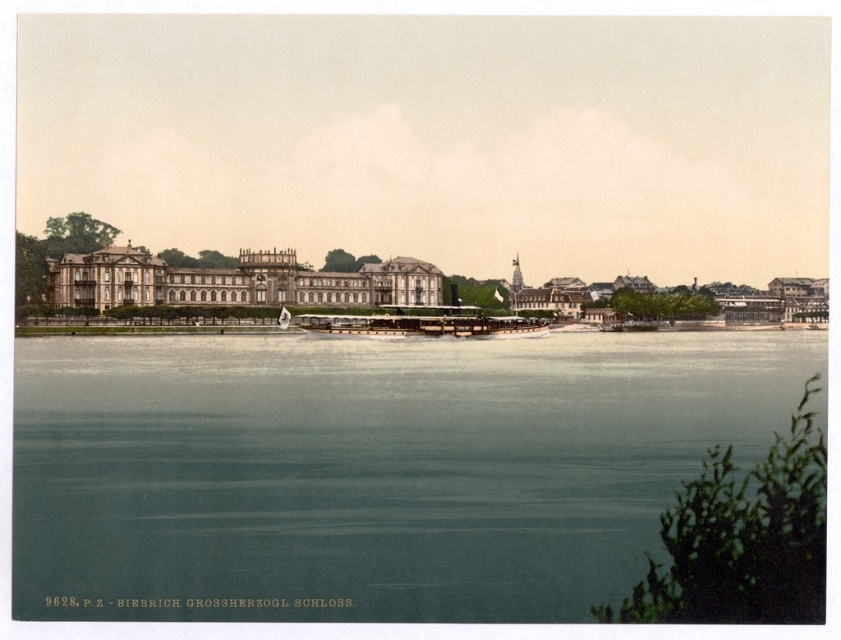
You are standing on the Rhine River bank opposite the Biebrich Grand Ducal Palace. You see a point marked at coordinates (x=236, y=282). What does this point represent?

The point at coordinates (x=236, y=282) corresponds to the beige stone palace at center.